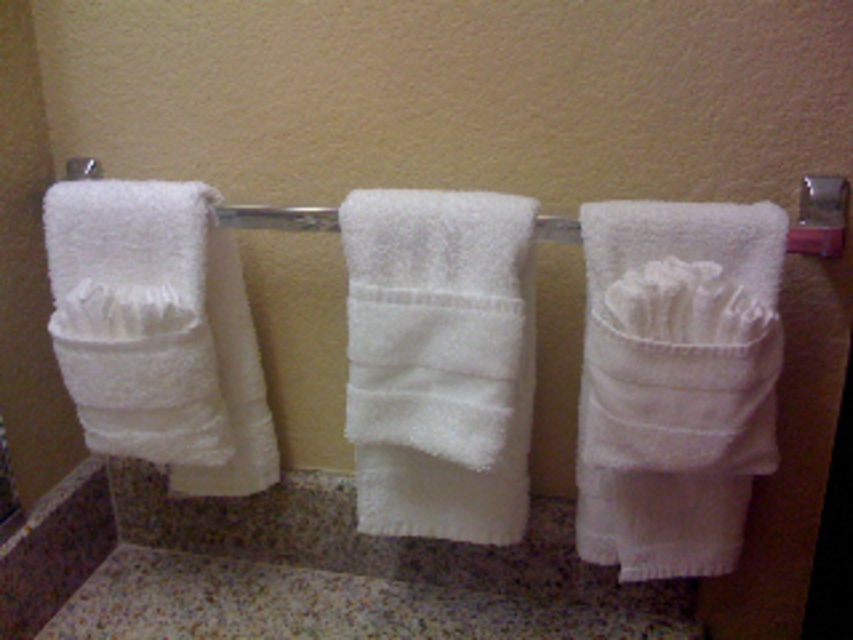
Question: In this image, where is white soft towel at right located relative to white fluffy towel at center?

Choices:
 (A) below
 (B) above

Answer: (A)

Question: Which point is farther to the camera?

Choices:
 (A) (430, 492)
 (B) (772, 400)

Answer: (A)

Question: Which point is closer to the camera?

Choices:
 (A) (751, 225)
 (B) (490, 492)

Answer: (A)

Question: In this image, where is white soft towel at right located relative to white fluffy towel at center?

Choices:
 (A) above
 (B) below

Answer: (B)

Question: Which of the following is the farthest from the observer?

Choices:
 (A) white fluffy towel at center
 (B) white soft towel at right

Answer: (A)

Question: Is white soft towel at right closer to camera compared to white fluffy towel at center?

Choices:
 (A) no
 (B) yes

Answer: (B)